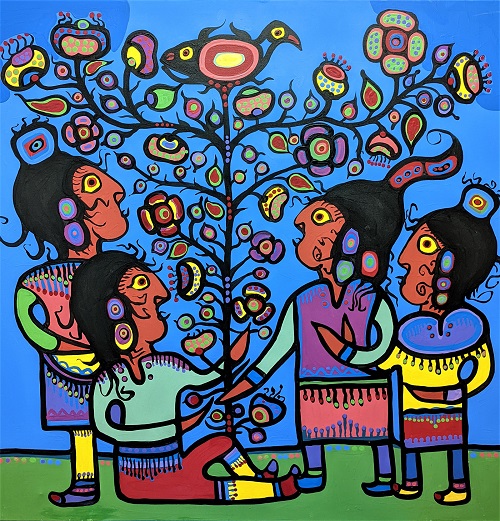
This screenshot has height=521, width=500. In order to click on upper left corner of artwork in this screenshot , I will do click(x=1, y=1).